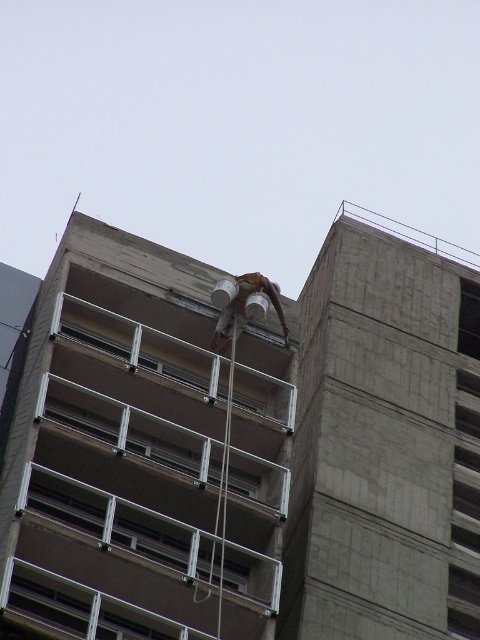
You are a safety inspector assessing the construction site. You notice the brown concrete balcony at center and the brown leather helmet at center. Which object is wider in terms of physical dimensions?

The brown concrete balcony at center is wider than the brown leather helmet at center according to the description.

You are standing on the ground floor of the building and looking up. You see the brown concrete balcony at center and the brown leather helmet at center. Which object is closer to you?

The brown concrete balcony at center is closer to you because it is in front of the brown leather helmet at center.

You are standing at the point labeled as point (144, 486) in the image. What object are you currently standing on?

You are standing on the brown concrete balcony at center.